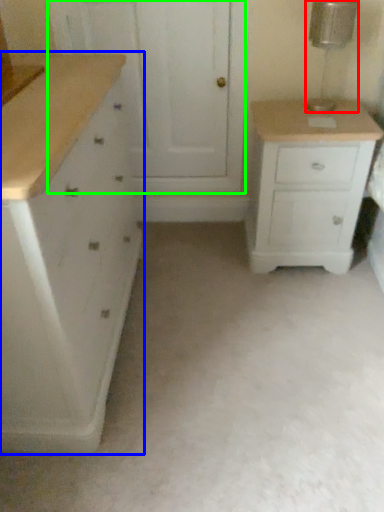
Question: Considering the real-world distances, which object is farthest from lamp (highlighted by a red box)? chest of drawers (highlighted by a blue box) or screen door (highlighted by a green box)?

Choices:
 (A) chest of drawers
 (B) screen door

Answer: (A)